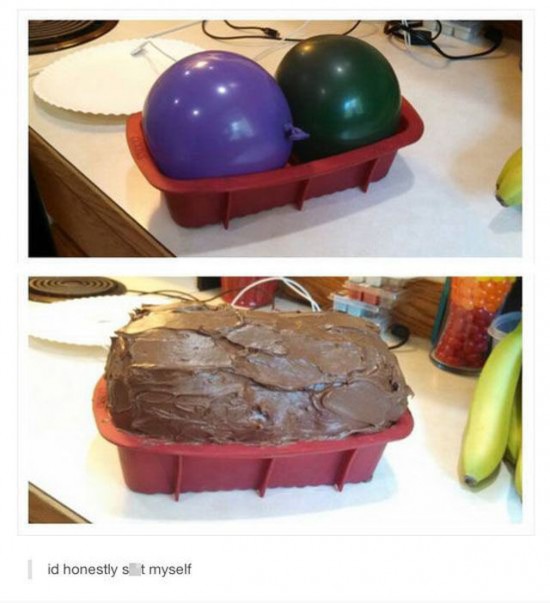
This screenshot has width=550, height=603. Find the location of `drawer`. drawer is located at coordinates (91, 234).